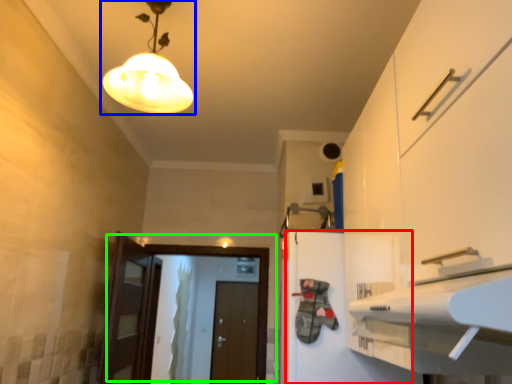
Question: Considering the real-world distances, which object is closest to cabinetry (highlighted by a red box)? lamp (highlighted by a blue box) or door (highlighted by a green box).

Choices:
 (A) lamp
 (B) door

Answer: (A)